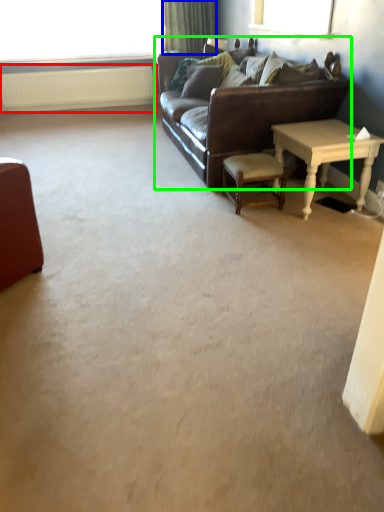
Question: Which object is the farthest from radiator (highlighted by a red box)? Choose among these: curtain (highlighted by a blue box) or studio couch (highlighted by a green box).

Choices:
 (A) curtain
 (B) studio couch

Answer: (B)